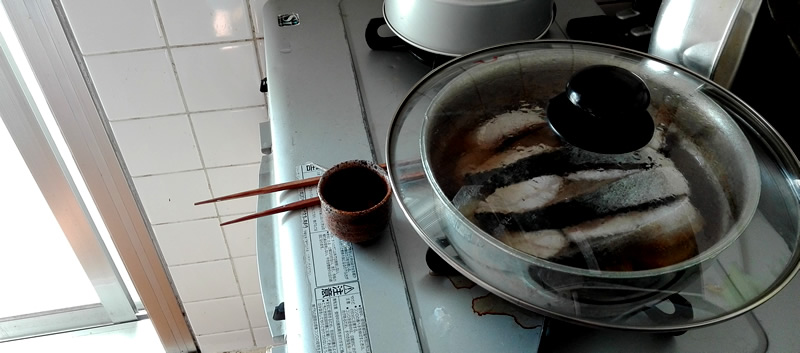
The width and height of the screenshot is (800, 353). What are the coordinates of `chopsticks` in the screenshot? It's located at (284, 183).